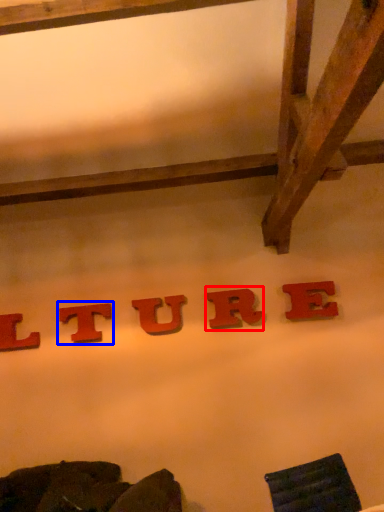
Question: Among these objects, which one is farthest to the camera, letter (highlighted by a red box) or letter (highlighted by a blue box)?

Choices:
 (A) letter
 (B) letter

Answer: (B)